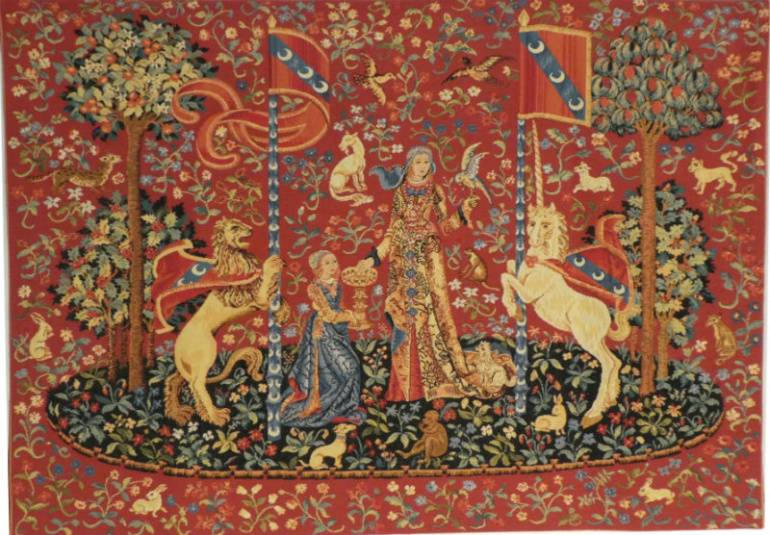
I want to click on tapestry, so pos(439,118).